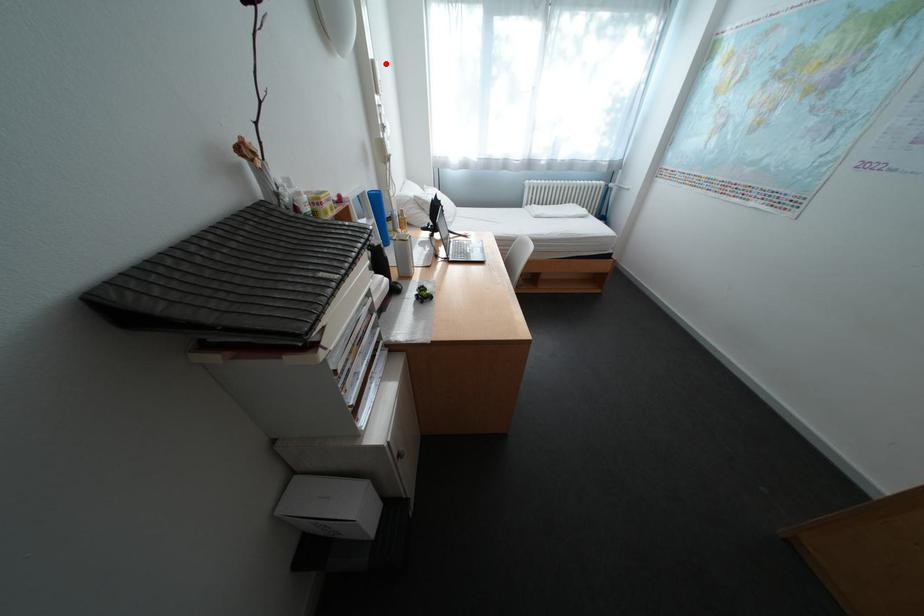
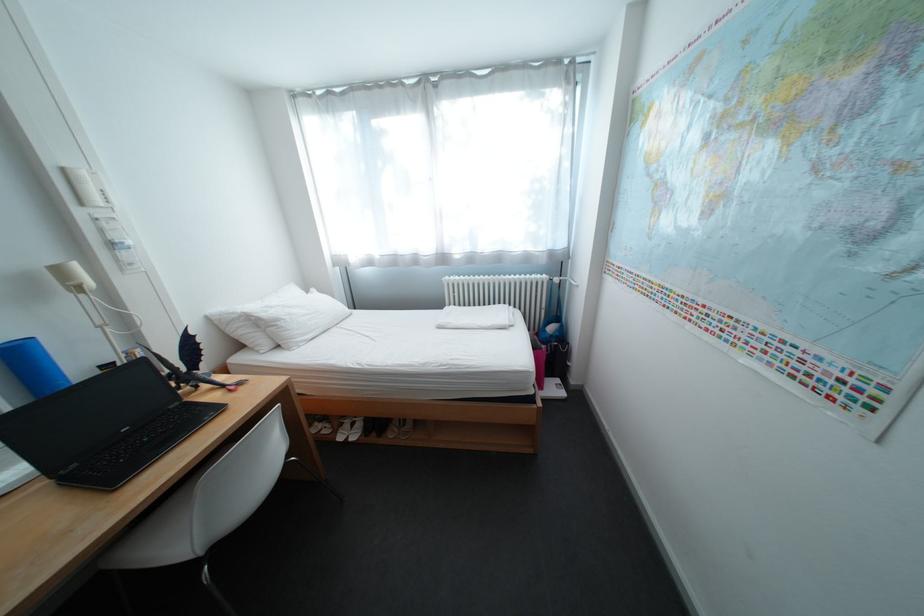
The point at the highlighted location is marked in the first image. Where is the corresponding point in the second image?

(76, 171)